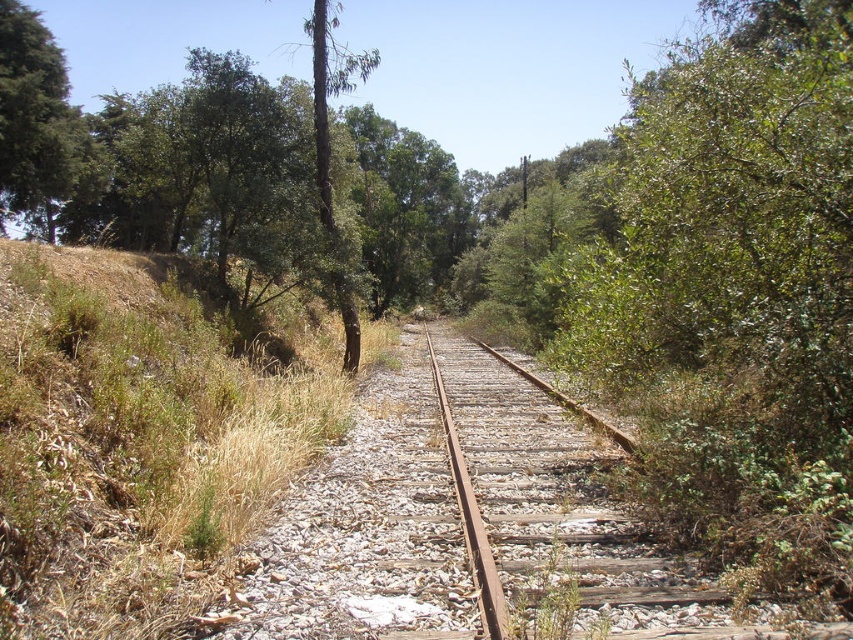
Question: Which point is farther to the camera?

Choices:
 (A) dry grass at left
 (B) green leafy tree at upper left
 (C) rusty metal train track at center

Answer: (B)

Question: Which object is positioned farthest from the green leafy tree at upper left?

Choices:
 (A) dry grass at left
 (B) rusty metal train track at center

Answer: (B)

Question: Can you confirm if dry grass at left is positioned to the left of green leafy tree at upper left?

Choices:
 (A) yes
 (B) no

Answer: (B)

Question: Does rusty metal train track at center have a lesser width compared to green leafy tree at upper left?

Choices:
 (A) no
 (B) yes

Answer: (B)

Question: Which point is farther to the camera?

Choices:
 (A) (56, 124)
 (B) (550, 522)

Answer: (A)

Question: Observing the image, what is the correct spatial positioning of dry grass at left in reference to green leafy tree at upper left?

Choices:
 (A) left
 (B) right

Answer: (B)